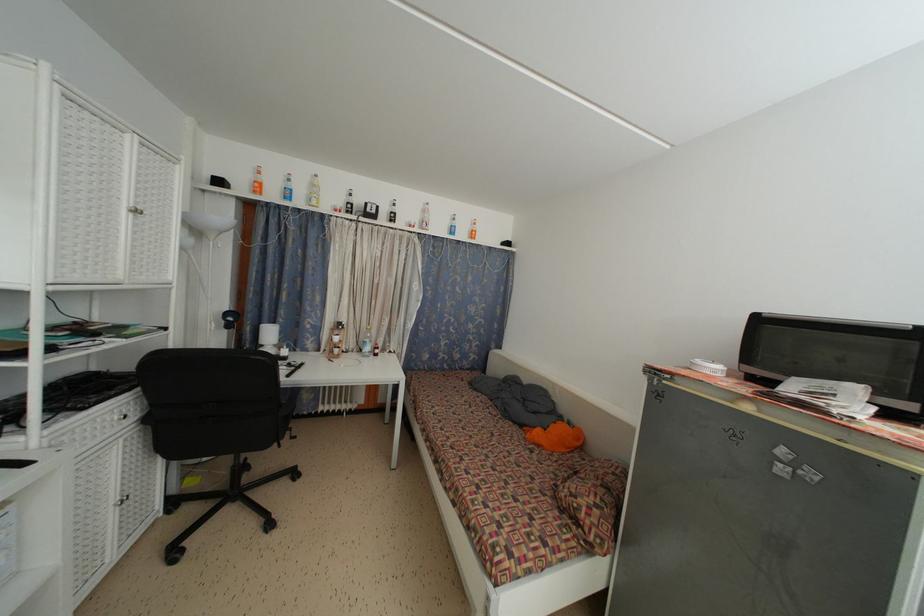
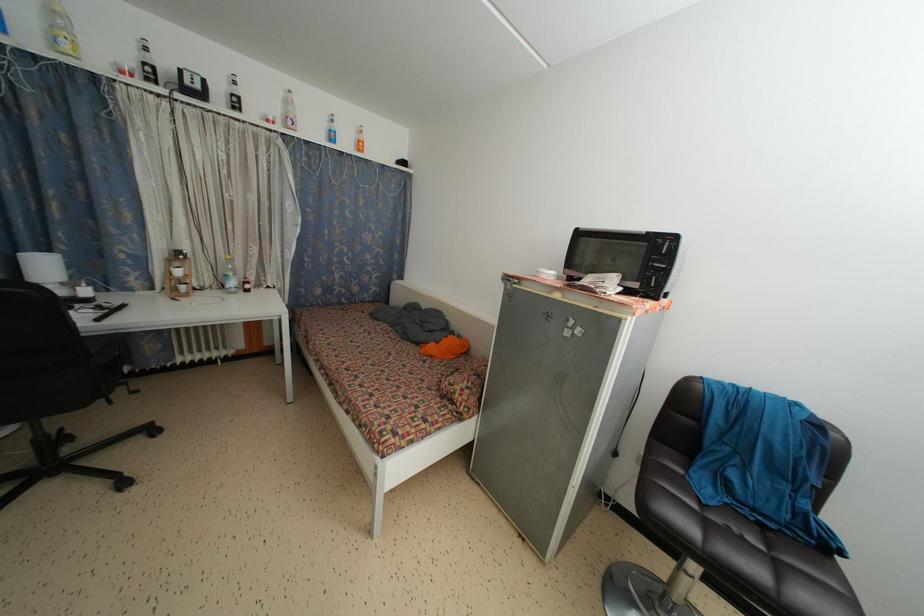
In the second image, find the point that corresponds to (x=371, y=354) in the first image.

(237, 289)